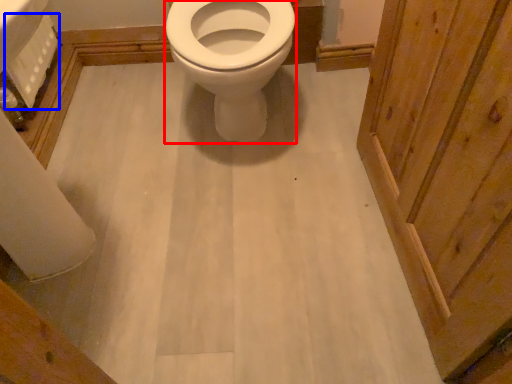
Question: Which point is further to the camera, bidet (highlighted by a red box) or toilet paper (highlighted by a blue box)?

Choices:
 (A) bidet
 (B) toilet paper

Answer: (B)